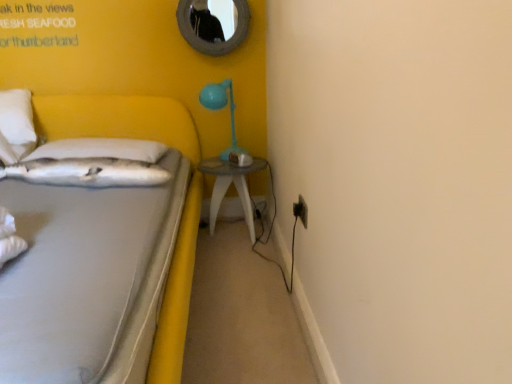
Question: Is white fabric bed at left bigger than rounded silver mirror at upper center?

Choices:
 (A) yes
 (B) no

Answer: (A)

Question: From the image's perspective, is white fabric bed at left under rounded silver mirror at upper center?

Choices:
 (A) yes
 (B) no

Answer: (A)

Question: Does white fabric bed at left turn towards rounded silver mirror at upper center?

Choices:
 (A) no
 (B) yes

Answer: (A)

Question: Is white fabric bed at left positioned far away from rounded silver mirror at upper center?

Choices:
 (A) yes
 (B) no

Answer: (B)

Question: Is white fabric bed at left shorter than rounded silver mirror at upper center?

Choices:
 (A) yes
 (B) no

Answer: (B)

Question: From a real-world perspective, is white fabric bed at left under rounded silver mirror at upper center?

Choices:
 (A) yes
 (B) no

Answer: (A)

Question: Is white soft pillow at left, which ranks as the first pillow in back-to-front order, placed right next to rounded silver mirror at upper center?

Choices:
 (A) no
 (B) yes

Answer: (A)

Question: Is white soft pillow at left, the second pillow positioned from the front, positioned beyond the bounds of rounded silver mirror at upper center?

Choices:
 (A) no
 (B) yes

Answer: (B)

Question: Is white soft pillow at left, which ranks as the first pillow in back-to-front order, looking in the opposite direction of rounded silver mirror at upper center?

Choices:
 (A) yes
 (B) no

Answer: (B)

Question: Is white soft pillow at left, the second pillow positioned from the front, aimed at rounded silver mirror at upper center?

Choices:
 (A) yes
 (B) no

Answer: (B)

Question: Is rounded silver mirror at upper center surrounded by white soft pillow at left, the second pillow positioned from the front?

Choices:
 (A) no
 (B) yes

Answer: (A)

Question: Can you confirm if white soft pillow at left, the second pillow positioned from the front, is positioned to the right of rounded silver mirror at upper center?

Choices:
 (A) no
 (B) yes

Answer: (A)

Question: From a real-world perspective, is white fabric bed at left under matte blue plastic table lamp at upper right?

Choices:
 (A) yes
 (B) no

Answer: (A)